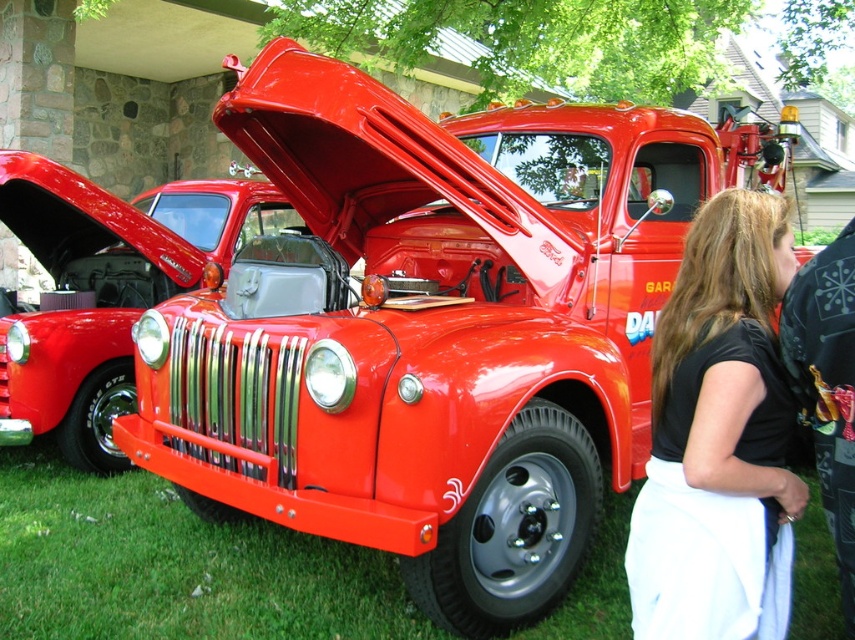
Question: Which point is farther to the camera?

Choices:
 (A) (805, 262)
 (B) (124, 285)

Answer: (B)

Question: Which point is farther to the camera?

Choices:
 (A) black fabric skirt at lower right
 (B) shiny metallic car at center
 (C) shiny chrome grill at center

Answer: (C)

Question: Is green grass at lower left to the right of shiny metallic car at center from the viewer's perspective?

Choices:
 (A) no
 (B) yes

Answer: (A)

Question: Does shiny chrome grill at center appear over shiny metallic car at center?

Choices:
 (A) yes
 (B) no

Answer: (A)

Question: Does black fabric skirt at lower right appear over shiny chrome grill at center?

Choices:
 (A) no
 (B) yes

Answer: (A)

Question: Estimate the real-world distances between objects in this image. Which object is farther from the shiny chrome grill at center?

Choices:
 (A) shiny metallic car at center
 (B) green grass at lower left

Answer: (A)